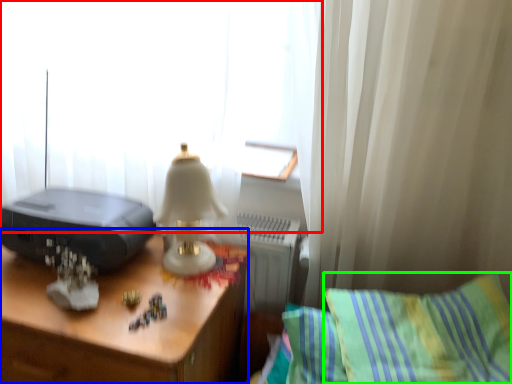
Question: Which object is the closest to the curtain (highlighted by a red box)? Choose among these: desk (highlighted by a blue box) or pillow (highlighted by a green box).

Choices:
 (A) desk
 (B) pillow

Answer: (A)